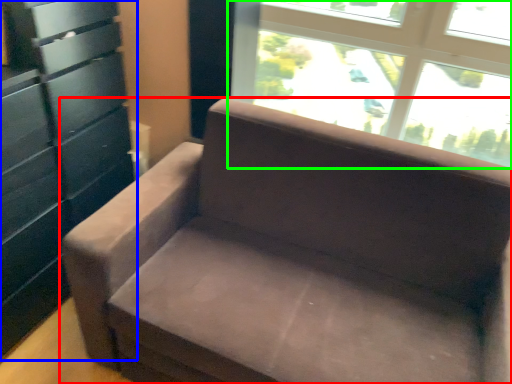
Question: Estimate the real-world distances between objects in this image. Which object is farther from studio couch (highlighted by a red box), dresser (highlighted by a blue box) or window (highlighted by a green box)?

Choices:
 (A) dresser
 (B) window

Answer: (B)